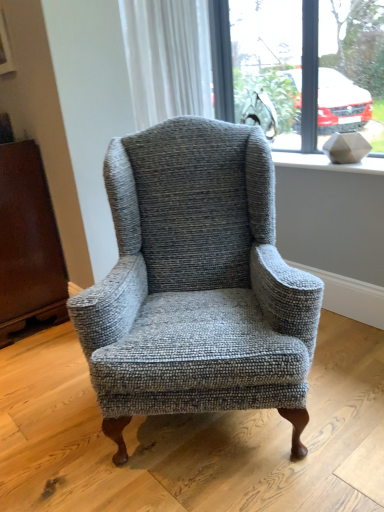
Measure the distance between point (x=348, y=167) and camera.

Point (x=348, y=167) and camera are 1.99 meters apart from each other.

This screenshot has height=512, width=384. What do you see at coordinates (327, 163) in the screenshot? I see `white textured stone at upper right` at bounding box center [327, 163].

This screenshot has height=512, width=384. Describe the element at coordinates (167, 58) in the screenshot. I see `white textured curtain at upper center` at that location.

Measure the distance between textured gray armchair at center and camera.

4.19 feet.

What is the approximate width of brown leather armoire at left?

It is 17.73 inches.

You are a GUI agent. You are given a task and a screenshot of the screen. Output one action in this format:
    pyautogui.click(x=<x>, y=<y>)
    Task: Click on the white textured stone at upper right
    The image size is (384, 512).
    Given the screenshot: What is the action you would take?
    (x=327, y=163)

Identify the location of window sill behind the clear glass window at upper center. This screenshot has height=512, width=384. (327, 163).

Would you say white textured stone at upper right is a long distance from clear glass window at upper center?

No, white textured stone at upper right is not far away from clear glass window at upper center.

Can we say white textured stone at upper right lies outside clear glass window at upper center?

Absolutely, white textured stone at upper right is external to clear glass window at upper center.

From the picture: Considering their positions, is white textured stone at upper right located in front of or behind clear glass window at upper center?

white textured stone at upper right is behind clear glass window at upper center.

The height and width of the screenshot is (512, 384). I want to click on window below the white textured curtain at upper center (from a real-world perspective), so click(299, 68).

Does white textured curtain at upper center contain clear glass window at upper center?

That's incorrect, clear glass window at upper center is not inside white textured curtain at upper center.

Is there a large distance between white textured curtain at upper center and clear glass window at upper center?

No, white textured curtain at upper center is not far away from clear glass window at upper center.

From the image's perspective, does white textured curtain at upper center appear lower than clear glass window at upper center?

No, from the image's perspective, white textured curtain at upper center is not below clear glass window at upper center.

From the image's perspective, which is below, brown leather armoire at left or clear glass window at upper center?

brown leather armoire at left is shown below in the image.

Considering the sizes of brown leather armoire at left and clear glass window at upper center in the image, is brown leather armoire at left wider or thinner than clear glass window at upper center?

brown leather armoire at left is wider than clear glass window at upper center.

How many degrees apart are the facing directions of brown leather armoire at left and clear glass window at upper center?

They differ by 0.283 degrees in their facing directions.

From the picture: From a real-world perspective, which is physically below, brown leather armoire at left or clear glass window at upper center?

brown leather armoire at left, from a real-world perspective.

Where is `chair below the white textured curtain at upper center (from the image's perspective)`? The width and height of the screenshot is (384, 512). chair below the white textured curtain at upper center (from the image's perspective) is located at coordinates (196, 283).

Considering the relative sizes of textured gray armchair at center and white textured curtain at upper center in the image provided, is textured gray armchair at center bigger than white textured curtain at upper center?

Correct, textured gray armchair at center is larger in size than white textured curtain at upper center.

From the image's perspective, which object appears higher, textured gray armchair at center or white textured curtain at upper center?

white textured curtain at upper center, from the image's perspective.

Where is `window sill in front of the white textured curtain at upper center`? The width and height of the screenshot is (384, 512). window sill in front of the white textured curtain at upper center is located at coordinates (327, 163).

Is white textured stone at upper right taller or shorter than white textured curtain at upper center?

In the image, white textured stone at upper right appears to be shorter than white textured curtain at upper center.

From the image's perspective, is white textured stone at upper right located beneath white textured curtain at upper center?

Yes.

Does point (319, 162) lie in front of point (128, 36)?

No.

You are a GUI agent. You are given a task and a screenshot of the screen. Output one action in this format:
    pyautogui.click(x=<x>, y=<y>)
    Task: Click on the window sill lying in front of the brown leather armoire at left
    
    Given the screenshot: What is the action you would take?
    pyautogui.click(x=327, y=163)

From a real-world perspective, is brown leather armoire at left below white textured stone at upper right?

Yes.

Is point (8, 179) farther from camera compared to point (293, 163)?

No, it is not.

Considering the relative sizes of brown leather armoire at left and white textured stone at upper right in the image provided, is brown leather armoire at left smaller than white textured stone at upper right?

Actually, brown leather armoire at left might be larger than white textured stone at upper right.

Does point (286, 139) come behind point (278, 162)?

That is True.

From a real-world perspective, does clear glass window at upper center sit lower than white textured stone at upper right?

Incorrect, from a real-world perspective, clear glass window at upper center is higher than white textured stone at upper right.

Can you confirm if clear glass window at upper center is thinner than white textured stone at upper right?

Correct, the width of clear glass window at upper center is less than that of white textured stone at upper right.

Is white textured stone at upper right surrounded by clear glass window at upper center?

Actually, white textured stone at upper right is outside clear glass window at upper center.

In the image, there is a clear glass window at upper center. Identify the location of window sill below it (from a real-world perspective). The height and width of the screenshot is (512, 384). (327, 163).

I want to click on curtain on the left side of clear glass window at upper center, so click(167, 58).

In the scene shown: Considering their positions, is brown leather armoire at left positioned closer to white textured stone at upper right than clear glass window at upper center?

Among the two, clear glass window at upper center is located nearer to white textured stone at upper right.

Looking at the image, which one is located further to textured gray armchair at center, clear glass window at upper center or white textured stone at upper right?

clear glass window at upper center.

Looking at the image, which one is located further to white textured curtain at upper center, white textured stone at upper right or textured gray armchair at center?

Based on the image, textured gray armchair at center appears to be further to white textured curtain at upper center.

Which object lies nearer to the anchor point clear glass window at upper center, white textured curtain at upper center or white textured stone at upper right?

Among the two, white textured curtain at upper center is located nearer to clear glass window at upper center.

Looking at the image, which one is located closer to brown leather armoire at left, clear glass window at upper center or white textured stone at upper right?

Based on the image, white textured stone at upper right appears to be nearer to brown leather armoire at left.

Estimate the real-world distances between objects in this image. Which object is further from brown leather armoire at left, white textured curtain at upper center or white textured stone at upper right?

white textured stone at upper right lies further to brown leather armoire at left than the other object.

Considering their positions, is clear glass window at upper center positioned closer to textured gray armchair at center than brown leather armoire at left?

brown leather armoire at left is closer to textured gray armchair at center.

From the image, which object appears to be nearer to white textured curtain at upper center, white textured stone at upper right or brown leather armoire at left?

Among the two, white textured stone at upper right is located nearer to white textured curtain at upper center.

The image size is (384, 512). I want to click on window between white textured curtain at upper center and textured gray armchair at center from top to bottom, so click(299, 68).

Where is `window between white textured curtain at upper center and white textured stone at upper right from left to right`? The width and height of the screenshot is (384, 512). window between white textured curtain at upper center and white textured stone at upper right from left to right is located at coordinates (299, 68).

You are a GUI agent. You are given a task and a screenshot of the screen. Output one action in this format:
    pyautogui.click(x=<x>, y=<y>)
    Task: Click on the curtain between brown leather armoire at left and white textured stone at upper right
    Image resolution: width=384 pixels, height=512 pixels.
    Given the screenshot: What is the action you would take?
    pyautogui.click(x=167, y=58)

Identify the location of chair between brown leather armoire at left and white textured stone at upper right in the horizontal direction. (196, 283).